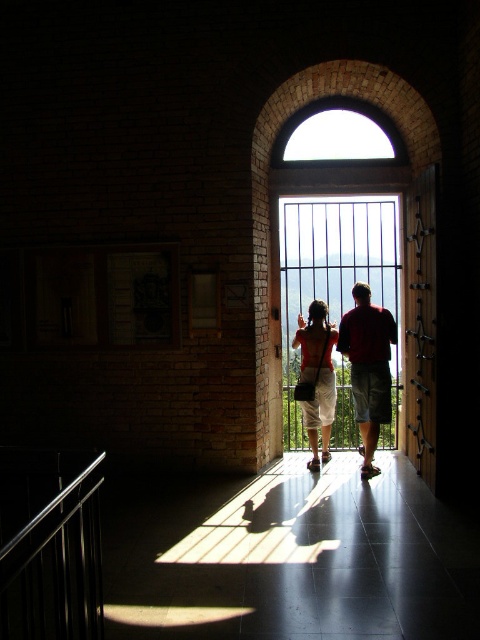
Question: Can you confirm if dark red shirt at center is positioned below matte red shirt at center?

Choices:
 (A) yes
 (B) no

Answer: (B)

Question: Considering the real-world distances, which object is closest to the matte red shirt at center?

Choices:
 (A) polished metal balustrade at lower left
 (B) clear glass window at center

Answer: (B)

Question: Estimate the real-world distances between objects in this image. Which object is closer to the dark red shirt at center?

Choices:
 (A) clear glass window at center
 (B) matte red shirt at center

Answer: (B)

Question: Is polished metal balustrade at lower left to the left of clear glass window at center from the viewer's perspective?

Choices:
 (A) no
 (B) yes

Answer: (B)

Question: Is polished metal balustrade at lower left wider than matte red shirt at center?

Choices:
 (A) no
 (B) yes

Answer: (B)

Question: Among these points, which one is farthest from the camera?

Choices:
 (A) (313, 339)
 (B) (347, 412)
 (C) (27, 634)

Answer: (B)